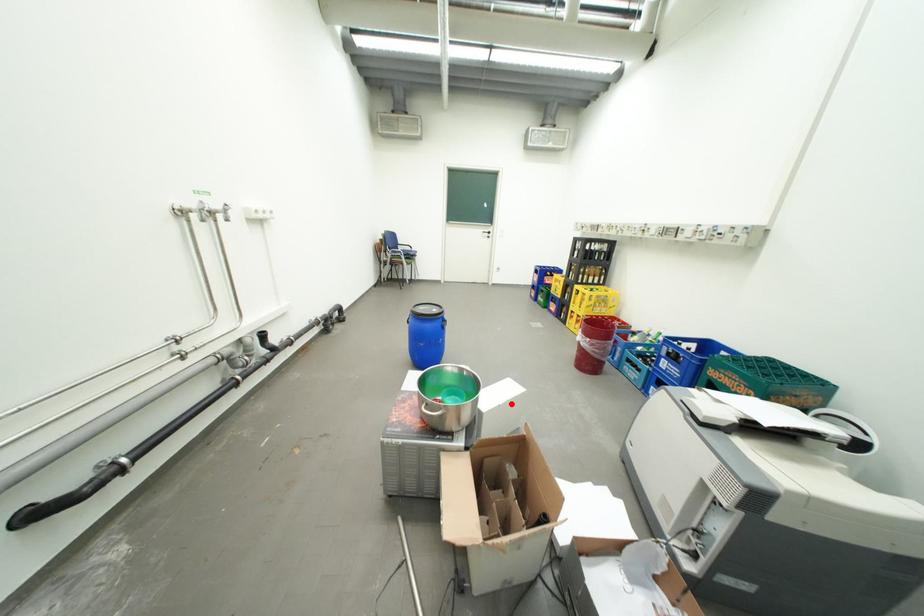
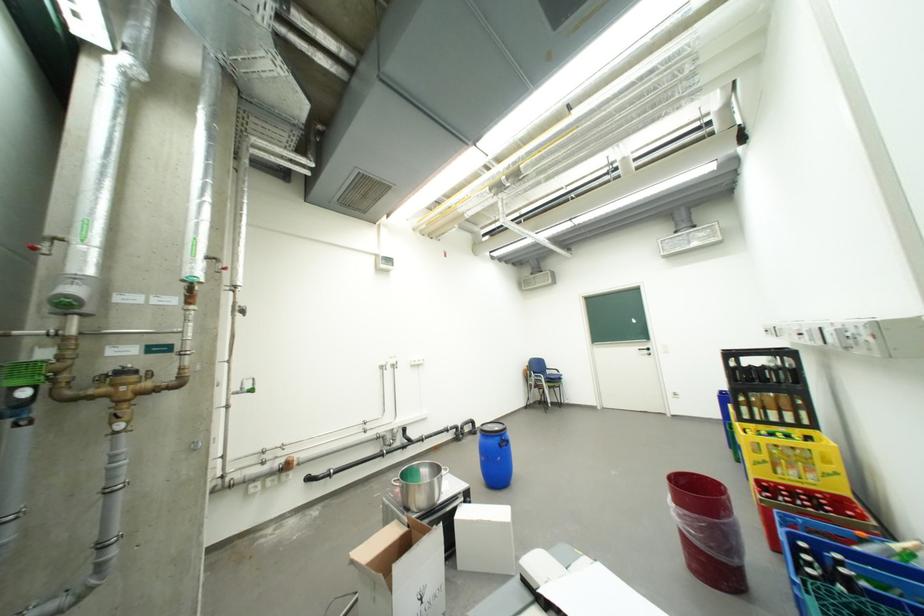
Question: I am providing you with two images of the same scene from different viewpoints. In image1, a red point is highlighted. Considering the same 3D point in image2, which of the following is correct?

Choices:
 (A) It is closer
 (B) It is farther

Answer: (A)